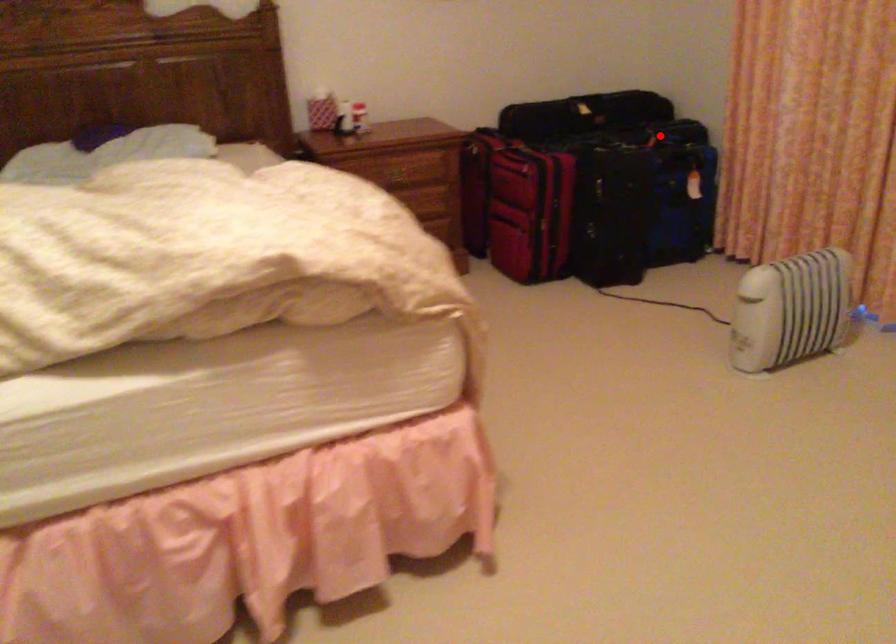
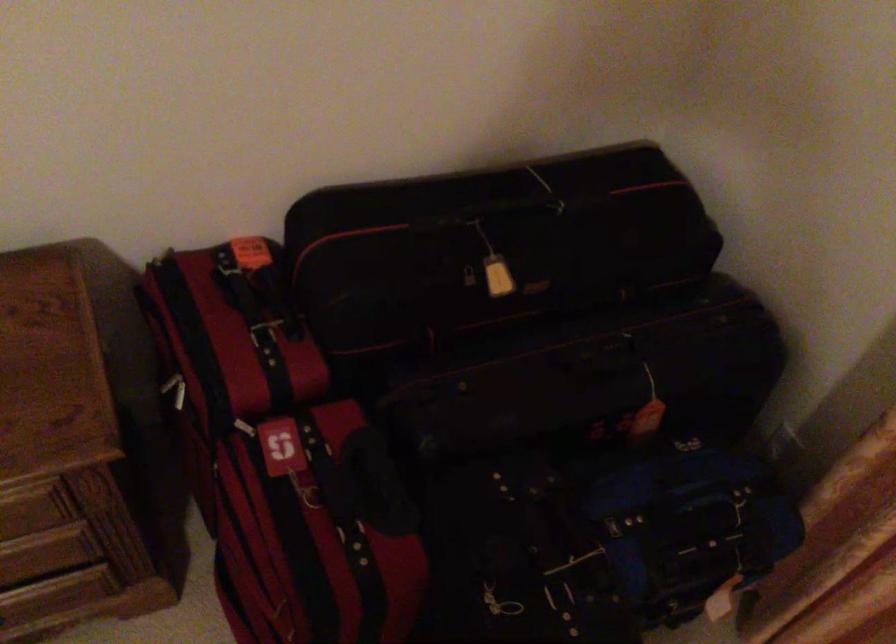
Locate, in the second image, the point that corresponds to the highlighted location in the first image.

(676, 507)